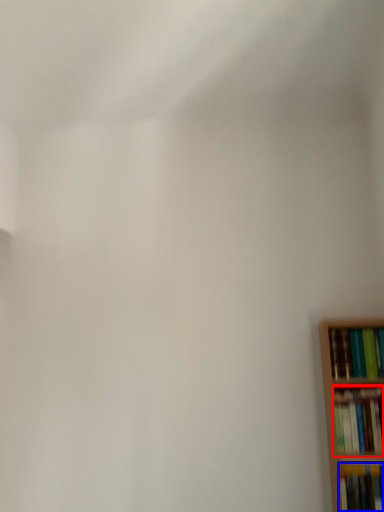
Question: Which object is closer to the camera taking this photo, book (highlighted by a red box) or book (highlighted by a blue box)?

Choices:
 (A) book
 (B) book

Answer: (B)